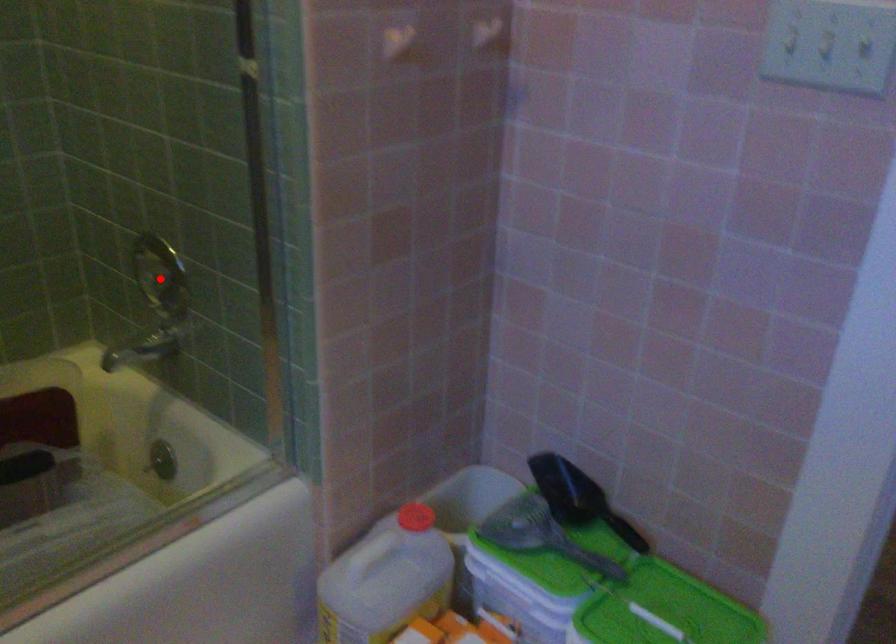
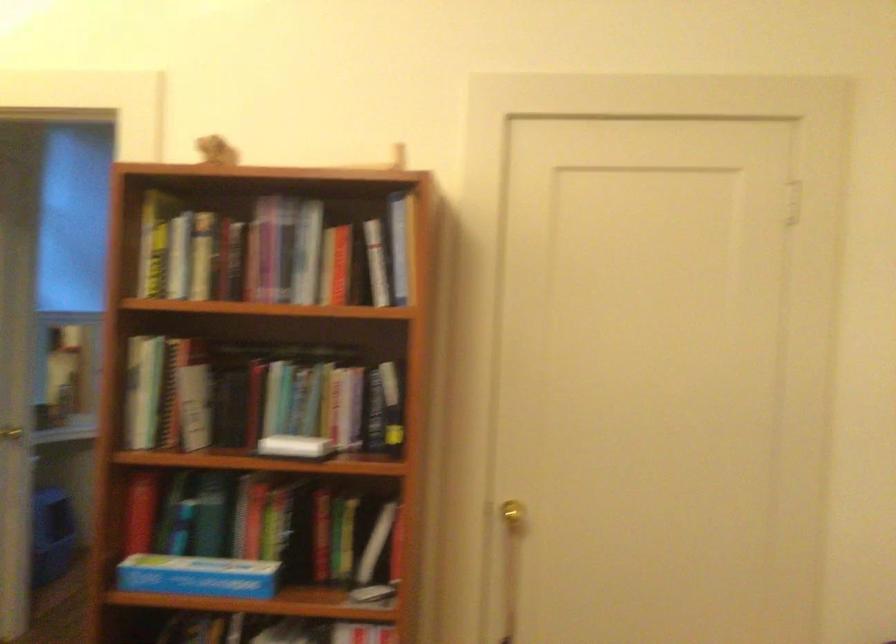
Question: I am providing you with two images of the same scene from different viewpoints. A red point is marked on the first image. Is the red point's position out of view in image 2?

Choices:
 (A) Yes
 (B) No

Answer: (A)